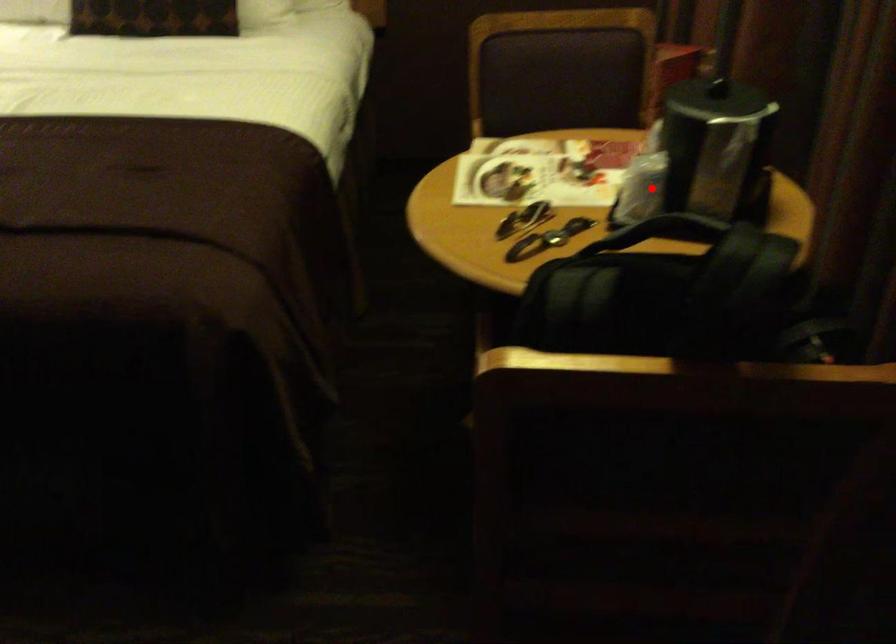
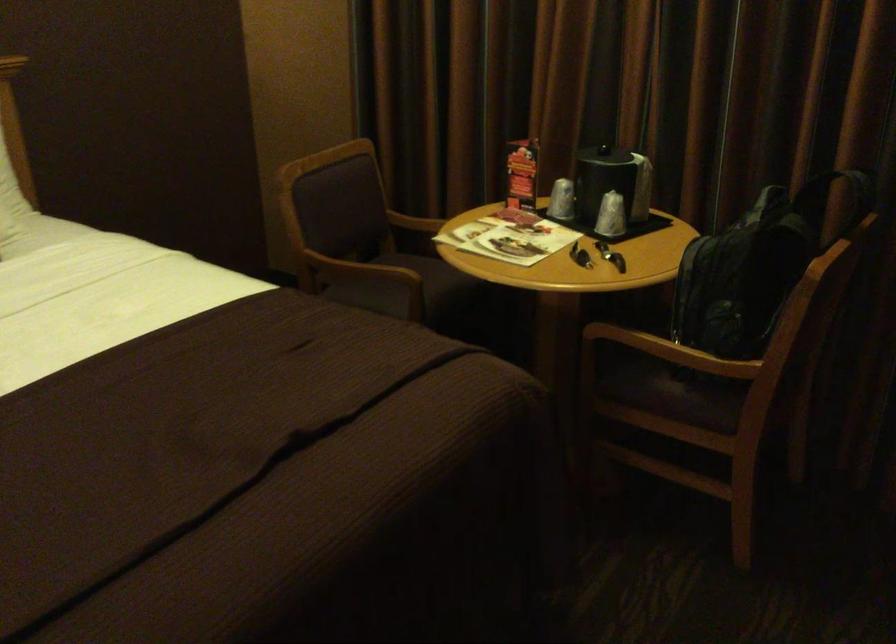
Question: I am providing you with two images of the same scene from different viewpoints. A red point is marked on the first image. Can you still see the location of the red point in image 2?

Choices:
 (A) Yes
 (B) No

Answer: (A)